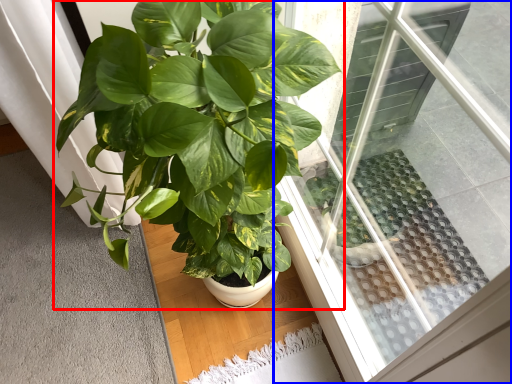
Question: Which object appears closest to the camera in this image, houseplant (highlighted by a red box) or window (highlighted by a blue box)?

Choices:
 (A) houseplant
 (B) window

Answer: (B)